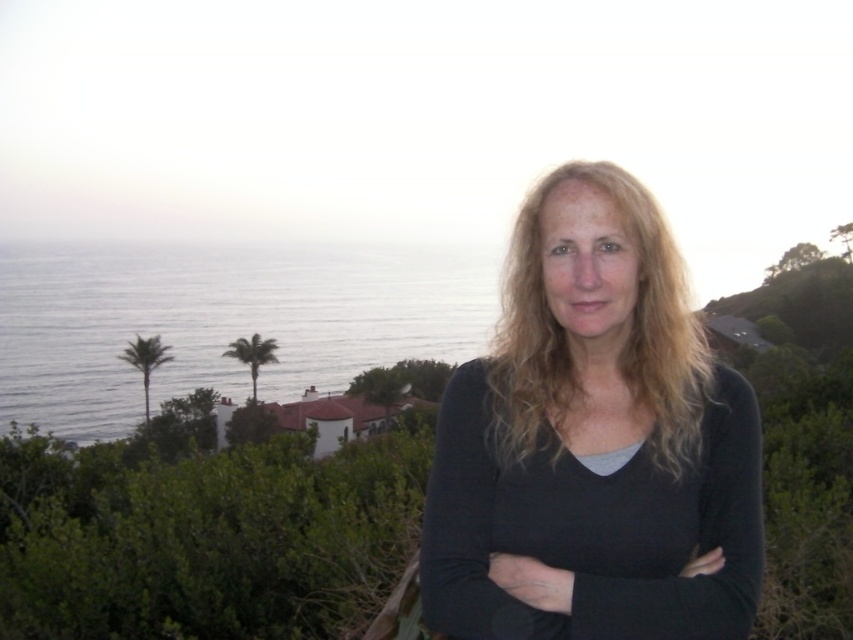
You are a photographer setting up a shot of the coastal view. You notice the black matte shirt at center and the black matte arm at center in your frame. Which object is positioned to the left in the image?

The black matte shirt at center is to the left of the black matte arm at center according to the description.

You are a photographer trying to capture the coastal scene. You notice the black matte shirt at center and the blue water at left. Which object is narrower in width?

The black matte shirt at center is narrower in width than the blue water at left.

You are designing a costume for a character that needs to have both a black matte shirt at center and a black matte arm at center. Based on the image, which one should be made larger to match the visual proportions?

The black matte shirt at center should be made larger than the black matte arm at center because the black matte shirt at center is larger in size than the black matte arm at center in the image.